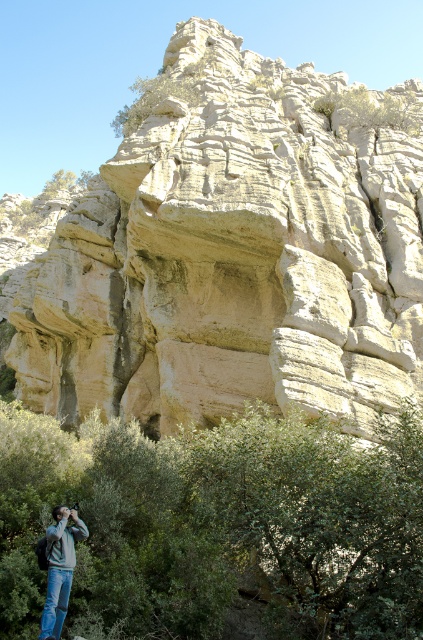
Question: Is light beige stone cliff at center above denim jacket at lower left?

Choices:
 (A) yes
 (B) no

Answer: (A)

Question: Observing the image, what is the correct spatial positioning of light beige stone cliff at center in reference to denim jacket at lower left?

Choices:
 (A) below
 (B) above

Answer: (B)

Question: Can you confirm if light beige stone cliff at center is thinner than denim jacket at lower left?

Choices:
 (A) no
 (B) yes

Answer: (A)

Question: Which point is closer to the camera?

Choices:
 (A) (54, 534)
 (B) (154, 227)

Answer: (A)

Question: Which point is closer to the camera?

Choices:
 (A) denim jacket at lower left
 (B) light beige stone cliff at center

Answer: (A)